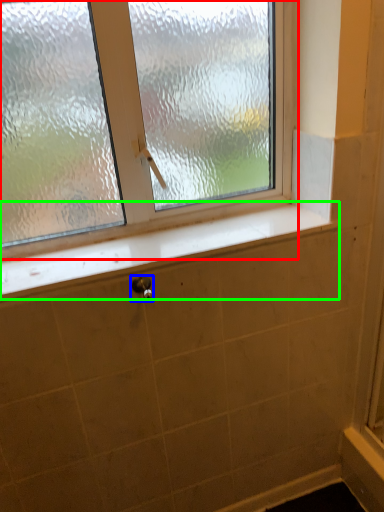
Question: Estimate the real-world distances between objects in this image. Which object is farther from window (highlighted by a red box), shower (highlighted by a blue box) or window sill (highlighted by a green box)?

Choices:
 (A) shower
 (B) window sill

Answer: (A)